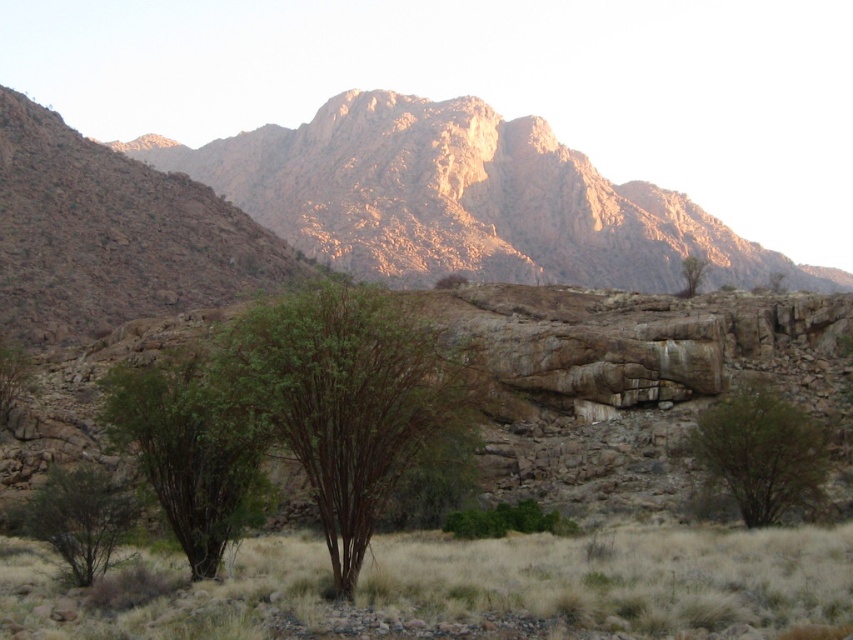
You are a botanist studying desert plants. You notice two plants at the lower left corner of the image. Which one is more to the left between the green leafy shrub at lower left and the green matte tree at lower left?

The green matte tree at lower left is more to the left because the green leafy shrub at lower left is positioned on its right side.

You are standing at the point marked as point (350,397) in the image. What object are you currently standing on?

You are standing on the brown textured tree at center.